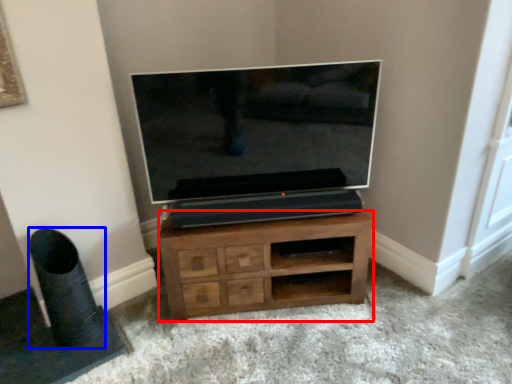
Question: Which object is further to the camera taking this photo, chest of drawers (highlighted by a red box) or speaker (highlighted by a blue box)?

Choices:
 (A) chest of drawers
 (B) speaker

Answer: (A)